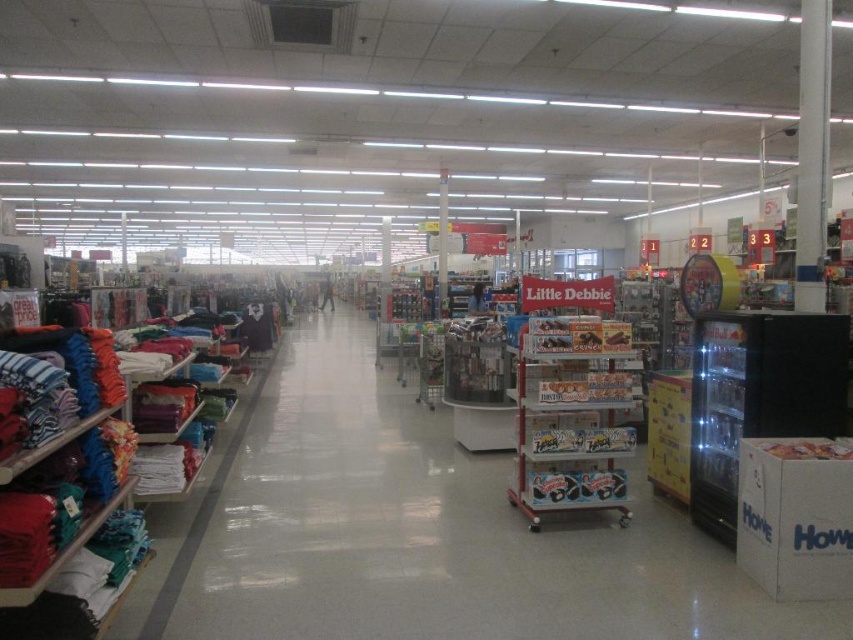
Is white plastic shelves at center to the left of blue cotton t-shirt at center from the viewer's perspective?

No, white plastic shelves at center is not to the left of blue cotton t-shirt at center.

How much distance is there between white plastic shelves at center and blue cotton t-shirt at center?

A distance of 36.53 meters exists between white plastic shelves at center and blue cotton t-shirt at center.

Identify the location of white plastic shelves at center. (422, 531).

Based on the photo, is white plastic shelves at center to the left of dark blue jersey at center from the viewer's perspective?

In fact, white plastic shelves at center is to the right of dark blue jersey at center.

Does white plastic shelves at center have a lesser height compared to dark blue jersey at center?

Yes.

The height and width of the screenshot is (640, 853). What do you see at coordinates (422, 531) in the screenshot? I see `white plastic shelves at center` at bounding box center [422, 531].

Where is `white plastic shelves at center`? The height and width of the screenshot is (640, 853). white plastic shelves at center is located at coordinates (422, 531).

Can you confirm if dark blue jersey at center is positioned above matte blue jeans at center?

No, dark blue jersey at center is not above matte blue jeans at center.

Is dark blue jersey at center to the right of matte blue jeans at center from the viewer's perspective?

Incorrect, dark blue jersey at center is not on the right side of matte blue jeans at center.

Is point (271, 314) less distant than point (469, 294)?

Yes.

The image size is (853, 640). Find the location of `dark blue jersey at center`. dark blue jersey at center is located at coordinates (257, 326).